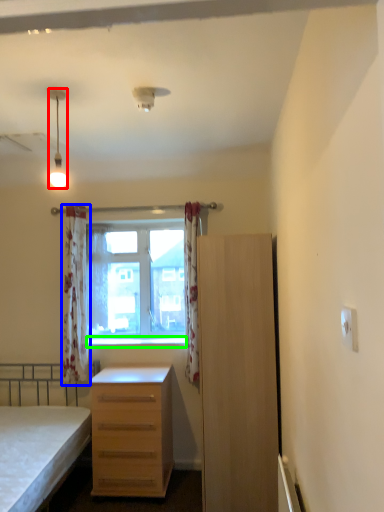
Question: Estimate the real-world distances between objects in this image. Which object is farther from lamp (highlighted by a red box), curtain (highlighted by a blue box) or window sill (highlighted by a green box)?

Choices:
 (A) curtain
 (B) window sill

Answer: (B)